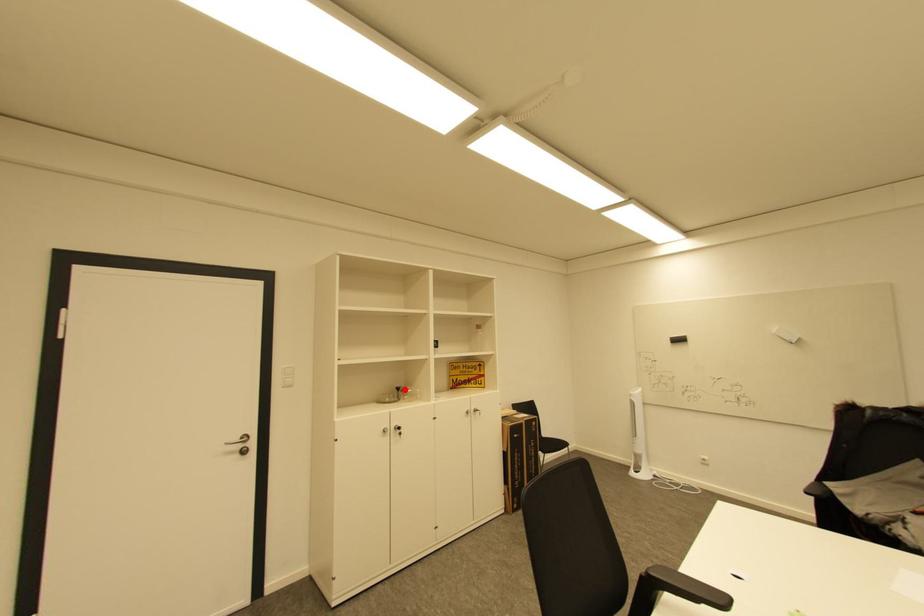
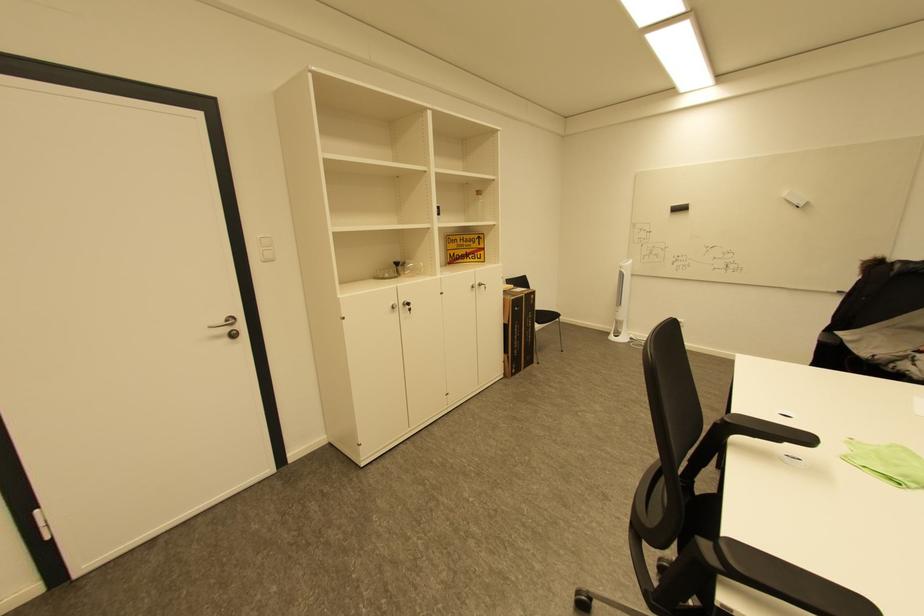
Where in the second image is the point corresponding to the highlighted location from the first image?

(403, 264)